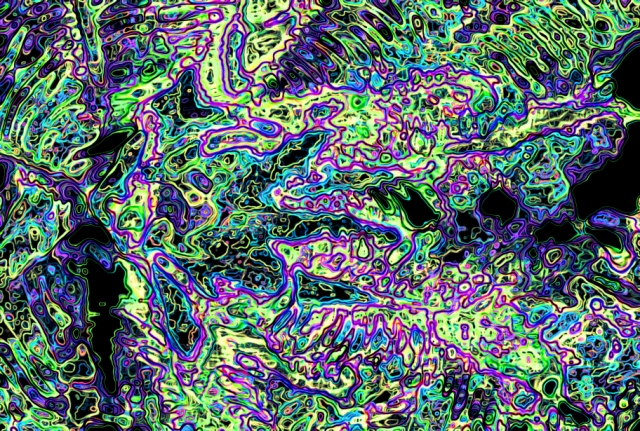
Find the location of a particular element. The width and height of the screenshot is (640, 431). abstract art is located at coordinates (337, 190).